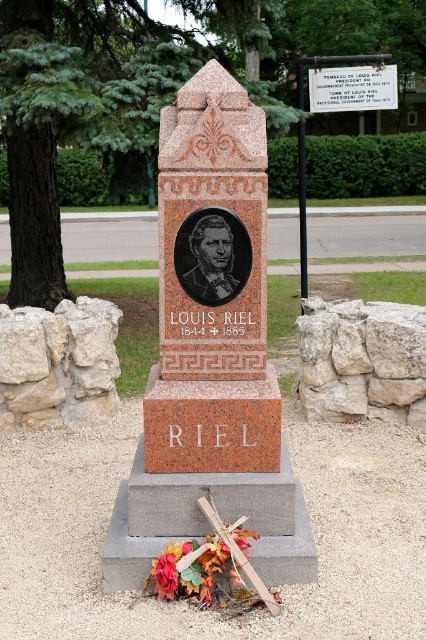
Does red granite monument at center have a lesser height compared to leaves and twigs at lower center?

No.

Does red granite monument at center have a lesser width compared to leaves and twigs at lower center?

No, red granite monument at center is not thinner than leaves and twigs at lower center.

The height and width of the screenshot is (640, 426). What do you see at coordinates (210, 358) in the screenshot?
I see `red granite monument at center` at bounding box center [210, 358].

The image size is (426, 640). I want to click on red granite monument at center, so click(210, 358).

From the picture: Can you confirm if leaves and twigs at lower center is taller than white marble plaque at upper center?

No, leaves and twigs at lower center is not taller than white marble plaque at upper center.

Which is in front, point (178, 548) or point (333, 88)?

Positioned in front is point (178, 548).

Locate an element on the screen. leaves and twigs at lower center is located at coordinates (193, 570).

Can you confirm if black polished stone portrait at center is thinner than white marble plaque at upper center?

Yes, black polished stone portrait at center is thinner than white marble plaque at upper center.

Which is above, black polished stone portrait at center or white marble plaque at upper center?

Positioned higher is white marble plaque at upper center.

Does point (235, 284) come farther from viewer compared to point (336, 104)?

No, it is in front of (336, 104).

I want to click on black polished stone portrait at center, so click(210, 260).